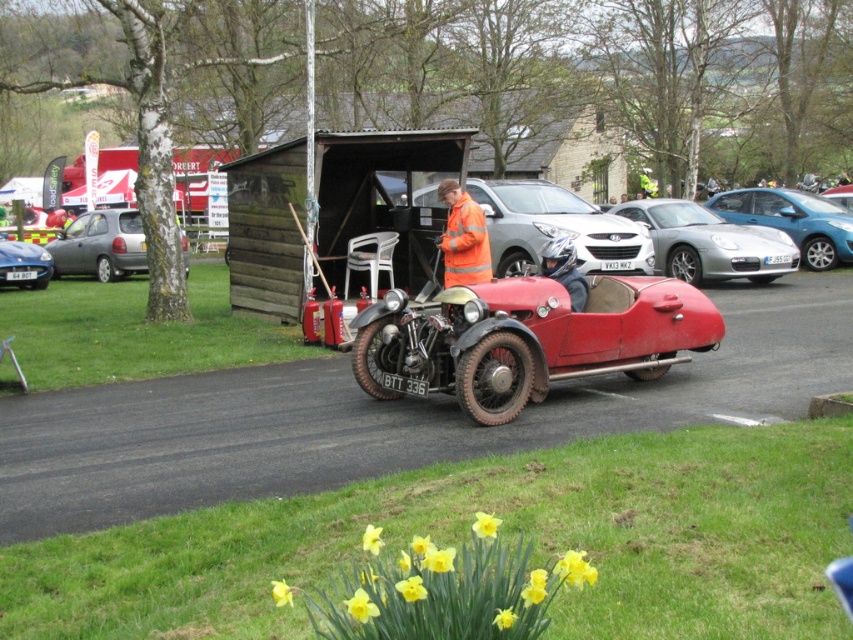
You are a photographer trying to capture both the silver metallic car at center and the matte black car at left in a single shot. Based on their positions, which car should you focus on first to ensure both are in frame?

The silver metallic car at center is positioned over matte black car at left, so you should focus on the silver metallic car at center first to ensure both are in frame.

You are a photographer setting up a shot of the yellow matte daffodil at lower center and the silver metallic hatchback at left. You want to ensure the daffodil is in focus while the hatchback is slightly blurred in the background. Is this possible given their positions?

The yellow matte daffodil at lower center is in front of the silver metallic hatchback at left, so focusing on the daffodil would naturally blur the hatchback in the background.

You are standing at the point with coordinates (445, 589) in the car show image. What object are you standing on?

You are standing on the yellow matte daffodil at lower center.